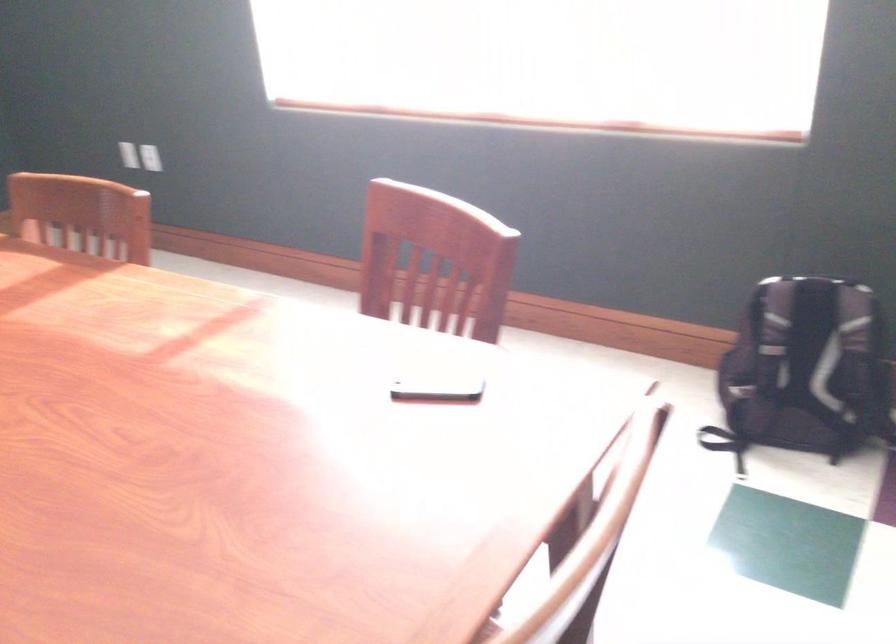
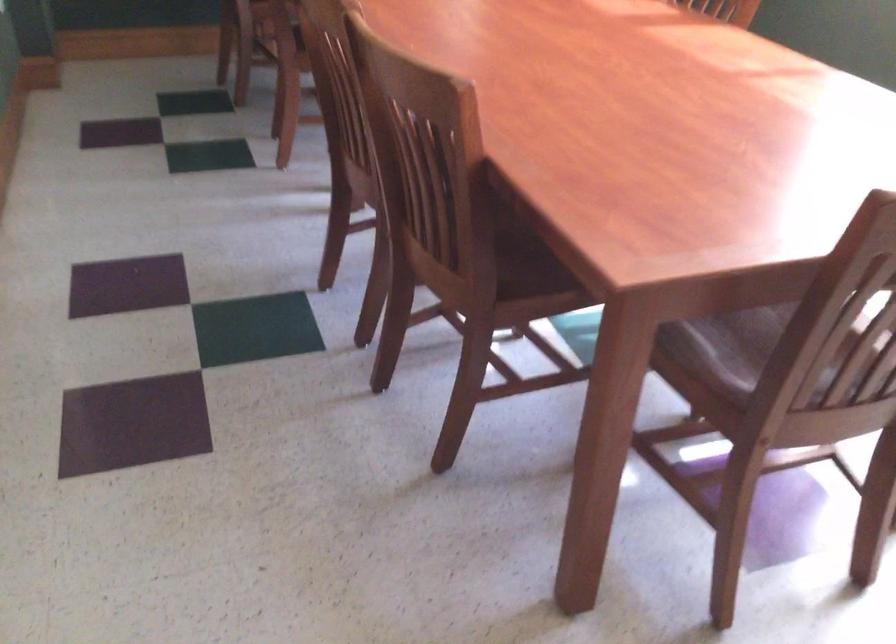
Question: The first image is from the beginning of the video and the second image is from the end. How did the camera likely rotate when shooting the video?

Choices:
 (A) Left
 (B) Right
 (C) Up
 (D) Down

Answer: (A)